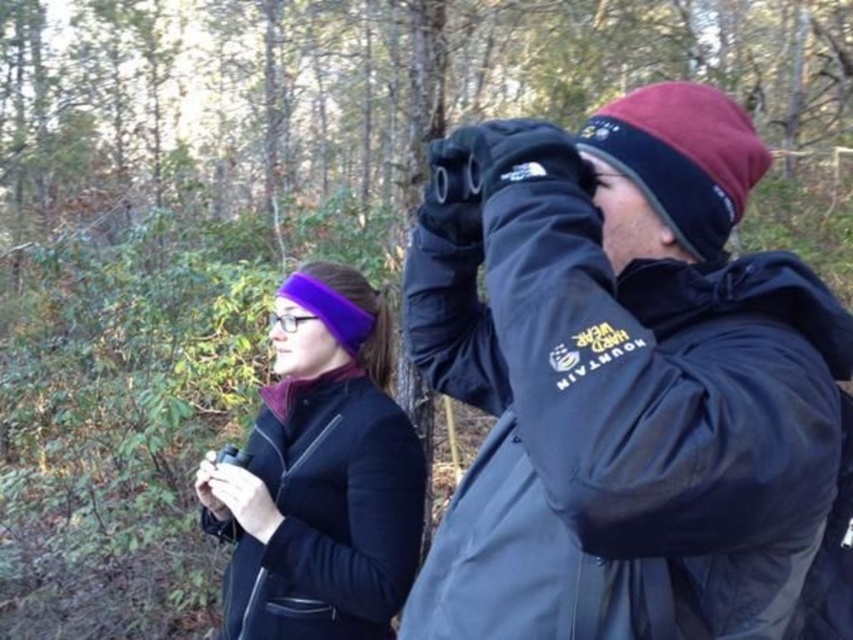
Question: Can you confirm if matte black jacket at center is positioned below purple fleece headband at center?

Choices:
 (A) no
 (B) yes

Answer: (A)

Question: Does matte black jacket at center appear on the right side of purple fleece headband at center?

Choices:
 (A) no
 (B) yes

Answer: (B)

Question: Which point appears closest to the camera in this image?

Choices:
 (A) (273, 422)
 (B) (480, 253)

Answer: (B)

Question: Does matte black jacket at center have a greater width compared to purple fleece headband at center?

Choices:
 (A) yes
 (B) no

Answer: (A)